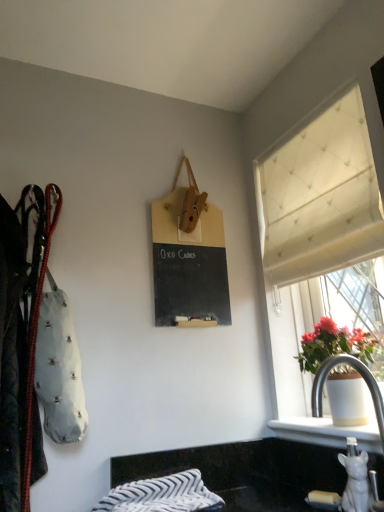
Question: Does leather coat at left have a greater width compared to white textured curtain at upper right?

Choices:
 (A) yes
 (B) no

Answer: (A)

Question: Does leather coat at left have a greater height compared to white textured curtain at upper right?

Choices:
 (A) no
 (B) yes

Answer: (A)

Question: Is leather coat at left in front of white textured curtain at upper right?

Choices:
 (A) no
 (B) yes

Answer: (B)

Question: Is leather coat at left thinner than white textured curtain at upper right?

Choices:
 (A) yes
 (B) no

Answer: (B)

Question: Is white textured curtain at upper right inside leather coat at left?

Choices:
 (A) no
 (B) yes

Answer: (A)

Question: From a real-world perspective, is leather coat at left located beneath white textured curtain at upper right?

Choices:
 (A) yes
 (B) no

Answer: (A)

Question: Does leather coat at left appear on the left side of white glossy sink at lower right?

Choices:
 (A) yes
 (B) no

Answer: (A)

Question: Does leather coat at left have a larger size compared to white glossy sink at lower right?

Choices:
 (A) yes
 (B) no

Answer: (A)

Question: Is leather coat at left not within white glossy sink at lower right?

Choices:
 (A) no
 (B) yes

Answer: (B)

Question: Is leather coat at left taller than white glossy sink at lower right?

Choices:
 (A) yes
 (B) no

Answer: (A)

Question: Does leather coat at left have a lesser height compared to white glossy sink at lower right?

Choices:
 (A) yes
 (B) no

Answer: (B)

Question: Is white glossy sink at lower right located within leather coat at left?

Choices:
 (A) yes
 (B) no

Answer: (B)

Question: From the image's perspective, is striped cotton blanket at lower center under leather coat at left?

Choices:
 (A) no
 (B) yes

Answer: (B)